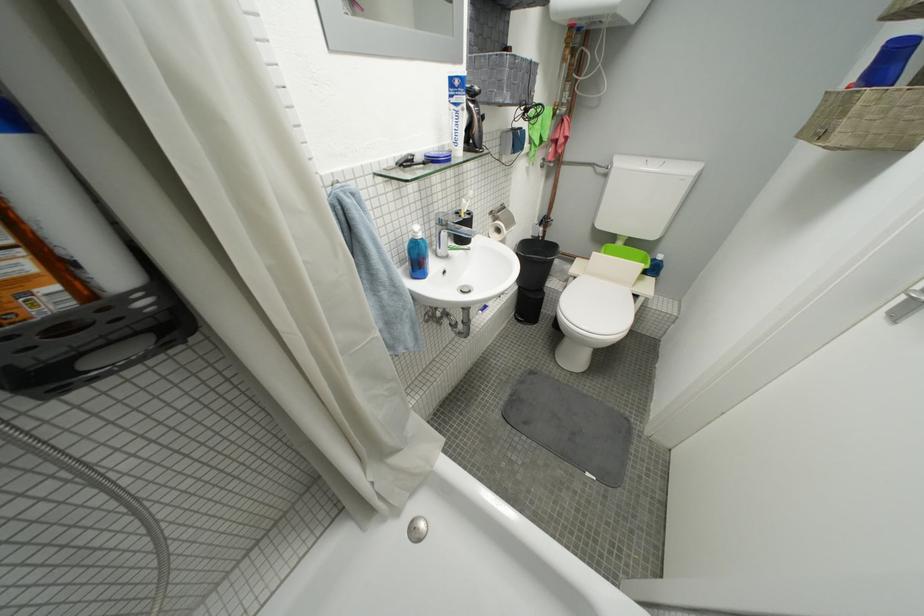
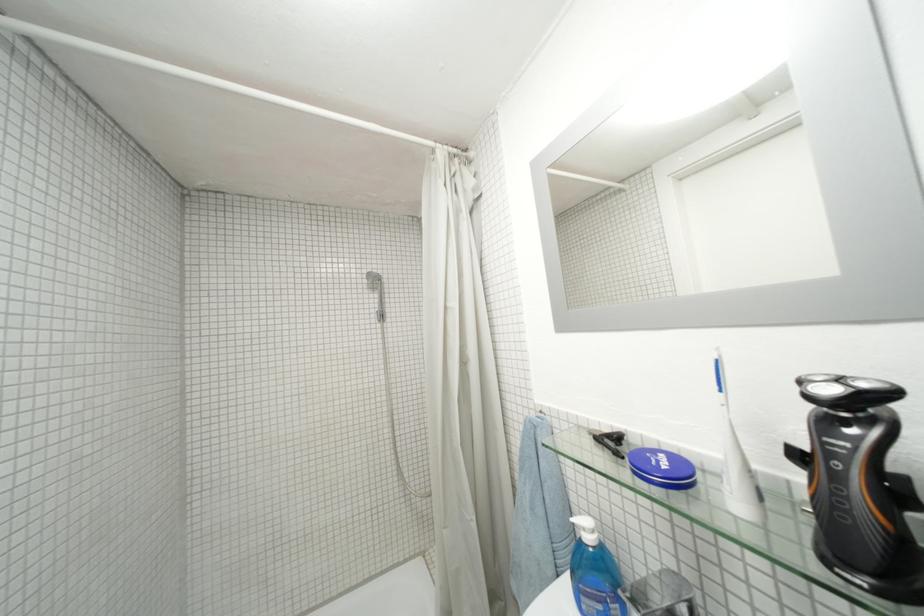
Locate, in the second image, the point that corresponds to (429,238) in the first image.

(598, 541)